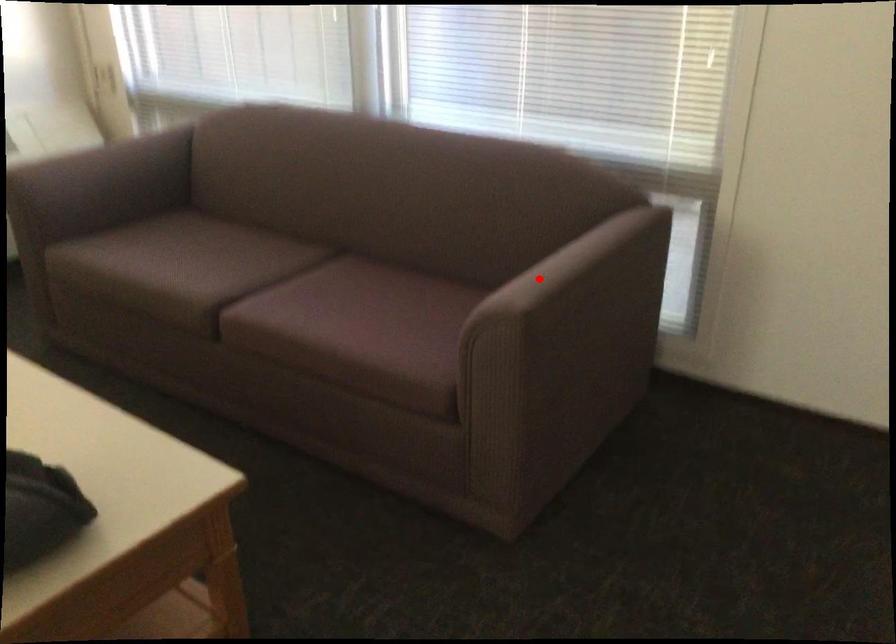
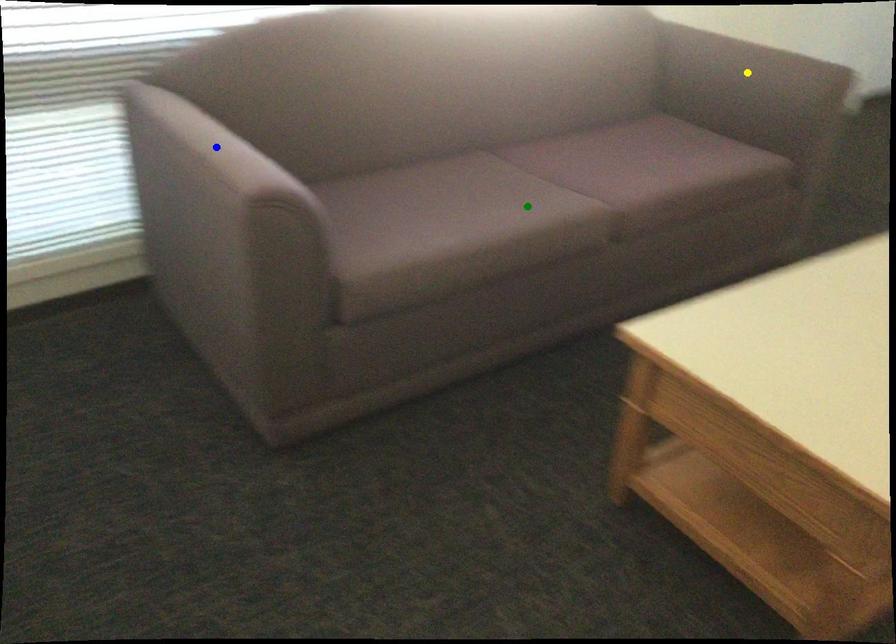
Question: I am providing you with two images of the same scene from different viewpoints. A red point is marked on the first image. You are given multiple points on the second image. Which mark in image 2 goes with the point in image 1?

Choices:
 (A) green point
 (B) blue point
 (C) yellow point

Answer: (C)